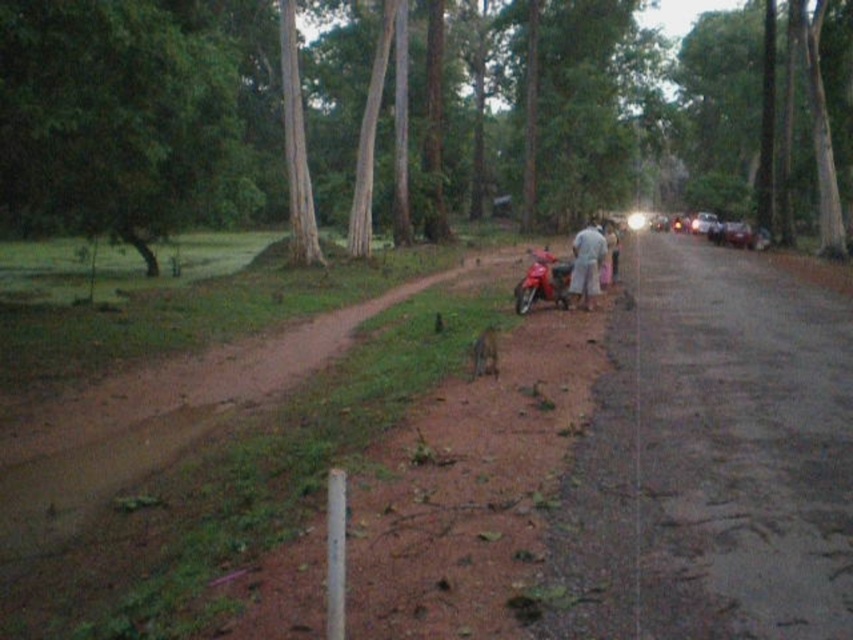
You are a pedestrian standing on the rural road and see the brown smooth tree at upper center and the light gray cotton shirt at center. Which object is higher from the ground?

The brown smooth tree at upper center is higher from the ground than the light gray cotton shirt at center because it is positioned above it.

You are standing on the rural road bordered by dense greenery and see a person wearing a light gray cotton shirt at center. Where is the light gray cotton shirt located in the image?

The light gray cotton shirt at center is located at point (589,262).

You are standing at the point marked by the coordinate point (x=630, y=113) in the rural road scene. What object is located exactly at that coordinate?

The point (x=630, y=113) marks the location of the brown smooth tree at upper center.